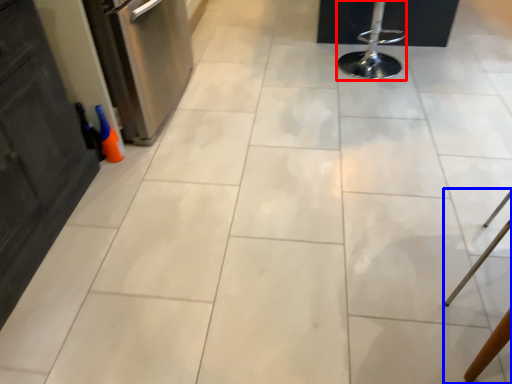
Question: Which object appears farthest to the camera in this image, bar stool (highlighted by a red box) or furniture (highlighted by a blue box)?

Choices:
 (A) bar stool
 (B) furniture

Answer: (A)